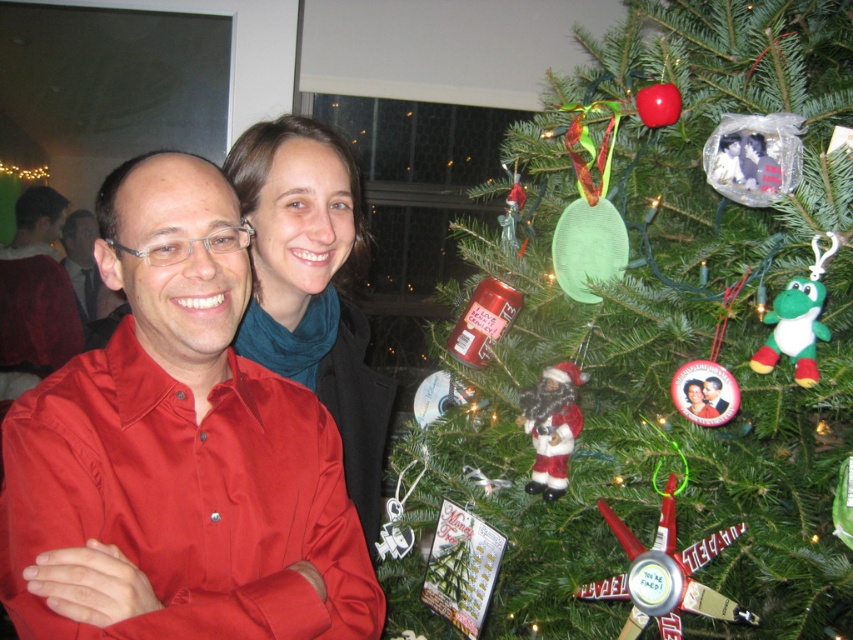
This screenshot has height=640, width=853. Describe the element at coordinates (675, 339) in the screenshot. I see `green matte christmas tree at center` at that location.

Which is in front, point (837, 561) or point (68, 637)?

Point (68, 637) is in front.

Locate an element on the screen. green matte christmas tree at center is located at coordinates (675, 339).

Can you confirm if green matte christmas tree at center is smaller than blue scarf at center?

No, green matte christmas tree at center is not smaller than blue scarf at center.

Is point (833, 588) positioned in front of point (254, 172)?

Yes, point (833, 588) is in front of point (254, 172).

The image size is (853, 640). I want to click on green matte christmas tree at center, so click(x=675, y=339).

This screenshot has width=853, height=640. I want to click on green matte christmas tree at center, so click(x=675, y=339).

What do you see at coordinates (177, 452) in the screenshot? The height and width of the screenshot is (640, 853). I see `satin red shirt at left` at bounding box center [177, 452].

The width and height of the screenshot is (853, 640). In order to click on satin red shirt at left in this screenshot , I will do pos(177,452).

Where is `satin red shirt at left`? The width and height of the screenshot is (853, 640). satin red shirt at left is located at coordinates (177, 452).